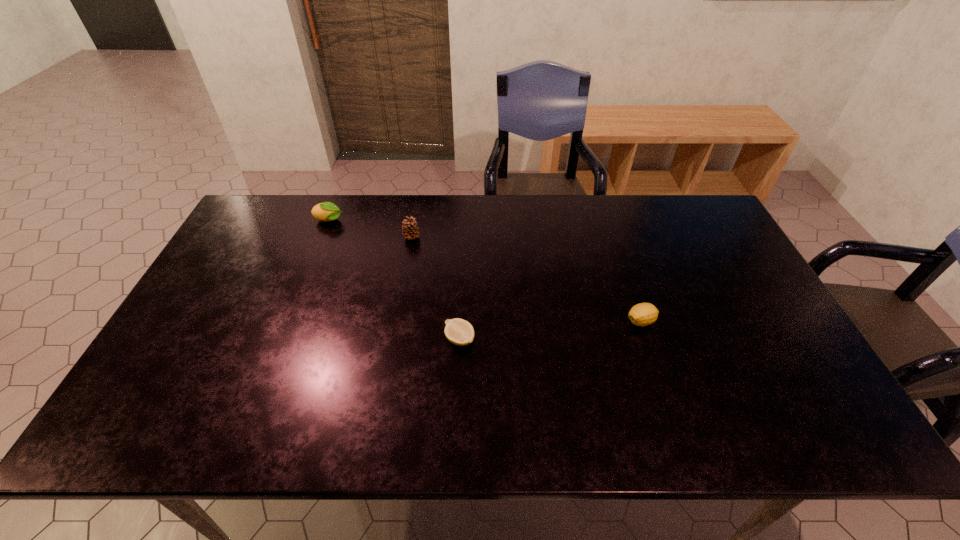
Identify the location of vacant region between the farthest lemon and the second object from left to right. The width and height of the screenshot is (960, 540). (371, 229).

The height and width of the screenshot is (540, 960). In order to click on object that is the second nearest to the second lemon from right to left in this screenshot , I will do [643, 314].

Select which object appears as the second closest to the second shortest lemon. Please provide its 2D coordinates. Your answer should be formatted as a tuple, i.e. [(x, y)], where the tuple contains the x and y coordinates of a point satisfying the conditions above.

[(410, 230)]

Find the location of a particular element. The image size is (960, 540). lemon object that ranks as the third closest to the third nearest object is located at coordinates (643, 314).

In order to click on lemon that is the third closest one to the third nearest object in this screenshot , I will do `click(643, 314)`.

Locate an element on the screen. This screenshot has width=960, height=540. vacant region that satisfies the following two spatial constraints: 1. with leaves positioned above the leftmost lemon; 2. on the left side of the shortest object is located at coordinates click(282, 339).

I want to click on free point that satisfies the following two spatial constraints: 1. with leaves positioned above the farthest lemon; 2. on the right side of the tallest object, so tap(323, 237).

Where is `free space in the image that satisfies the following two spatial constraints: 1. with leaves positioned above the tallest object; 2. on the left side of the farthest object`? The width and height of the screenshot is (960, 540). free space in the image that satisfies the following two spatial constraints: 1. with leaves positioned above the tallest object; 2. on the left side of the farthest object is located at coordinates (323, 237).

Locate an element on the screen. The height and width of the screenshot is (540, 960). free space that satisfies the following two spatial constraints: 1. with leaves positioned above the farthest lemon; 2. on the back side of the shortest object is located at coordinates (282, 339).